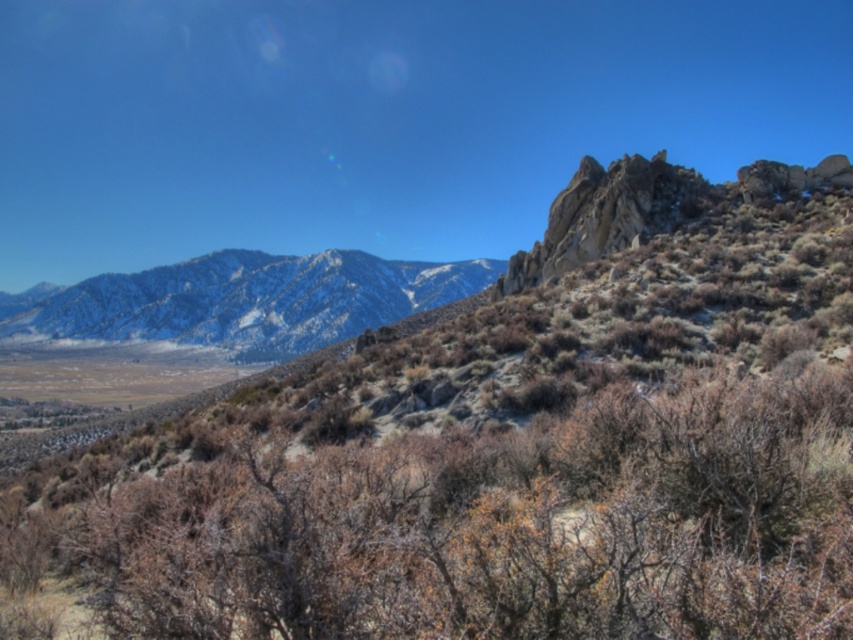
You are a hiker planning to cross the valley. You notice the brown textured shrub at center and the snowy rocky mountain range at upper left. Which of these two landmarks is taller?

The brown textured shrub at center is not as tall as the snowy rocky mountain range at upper left, so the snowy rocky mountain range at upper left is taller.

You are a hiker planning to cross the valley from the brown textured shrub at center to the snowy rocky mountain range at upper left. Considering their sizes, which object would be easier to navigate around?

The brown textured shrub at center has a smaller size compared to the snowy rocky mountain range at upper left, so it would be easier to navigate around the brown textured shrub at center.

You are a hiker planning to cross the valley and need to avoid the brown textured shrub at center. Based on the coordinates provided, which direction should you move to bypass it?

The brown textured shrub at center is located at point (471, 522). To bypass it, you should move either to the left or right, staying away from the central area of the valley.